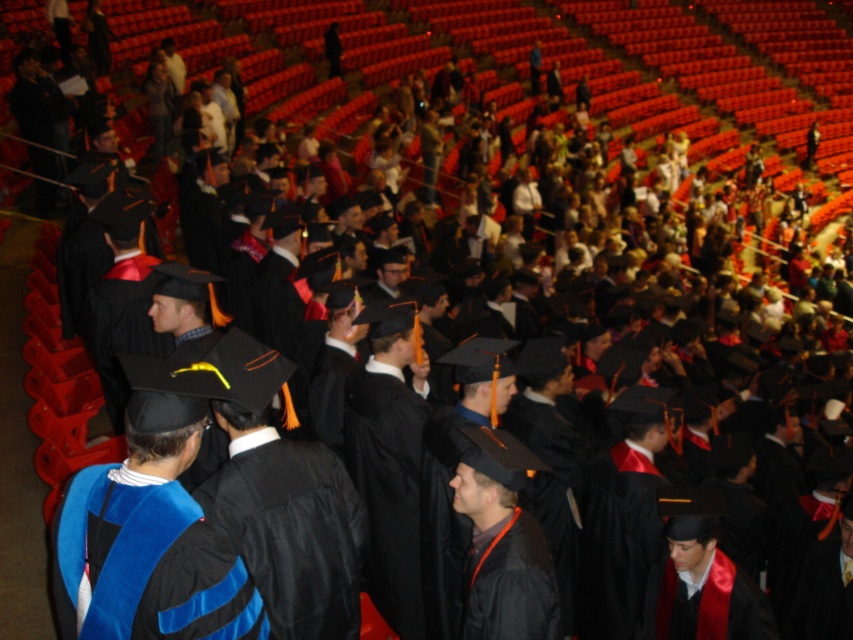
Question: Can you confirm if blue velvet graduation gown at center is smaller than matte black graduation gown at center?

Choices:
 (A) yes
 (B) no

Answer: (A)

Question: Which point is farther to the camera?

Choices:
 (A) matte black graduation gown at center
 (B) blue velvet graduation gown at center

Answer: (A)

Question: Does blue velvet graduation gown at center appear on the right side of matte black graduation gown at center?

Choices:
 (A) no
 (B) yes

Answer: (A)

Question: Which of these objects is positioned closest to the matte black graduation gown at center?

Choices:
 (A) black matte graduation gown at center
 (B) blue velvet graduation gown at center

Answer: (A)

Question: Is black matte graduation gown at center below matte black graduation gown at center?

Choices:
 (A) yes
 (B) no

Answer: (A)

Question: Which of the following is the closest to the observer?

Choices:
 (A) (173, 548)
 (B) (326, 516)

Answer: (A)